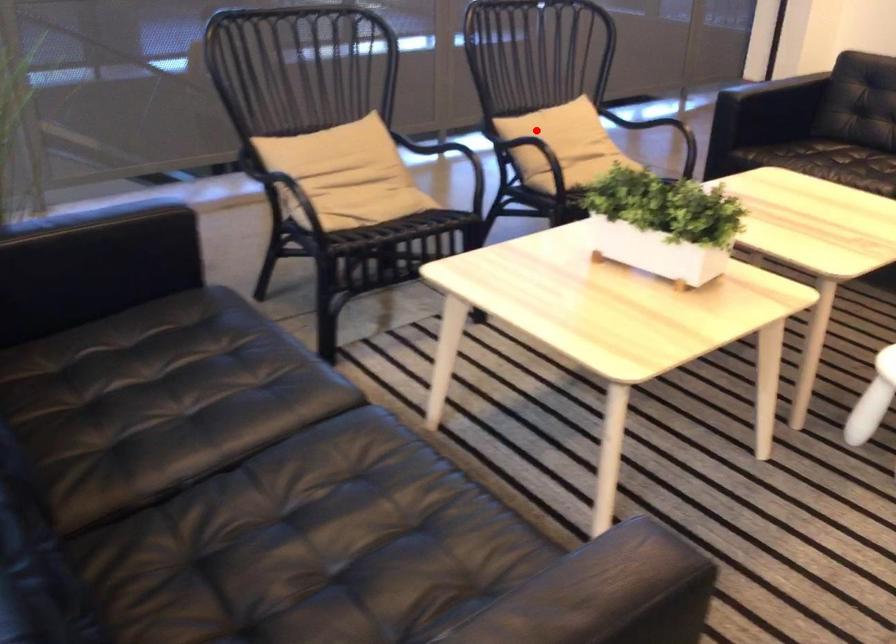
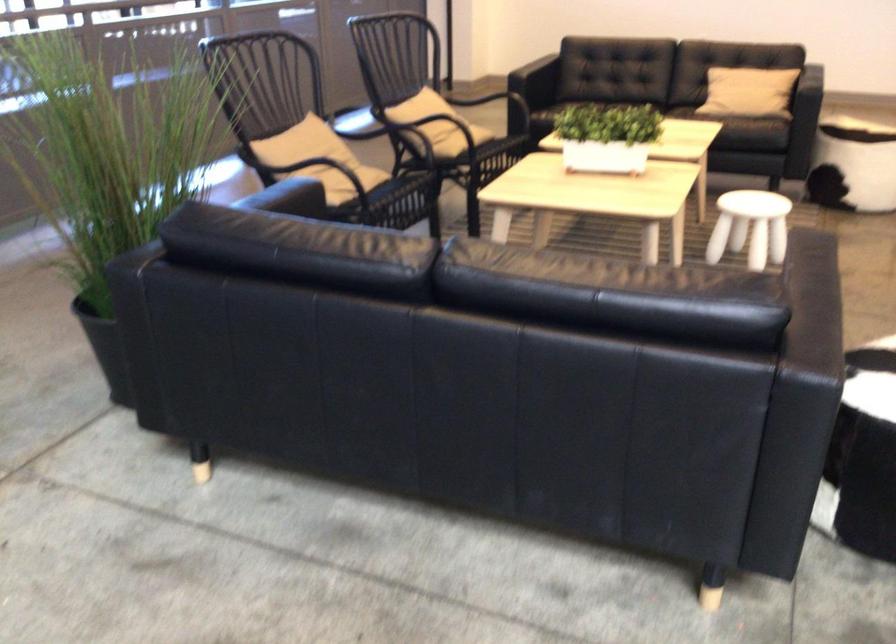
Locate, in the second image, the point that corresponds to the highlighted location in the first image.

(431, 111)